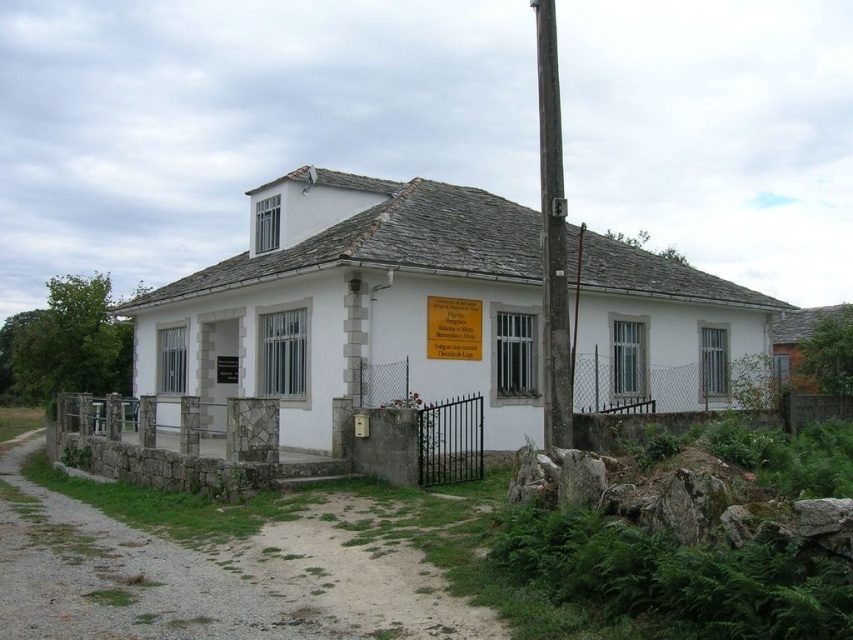
Question: Which object is closer to the camera taking this photo?

Choices:
 (A) smooth wooden pole at right
 (B) wooden plaque at center

Answer: (A)

Question: Which object appears closest to the camera in this image?

Choices:
 (A) wooden plaque at center
 (B) smooth wooden pole at right

Answer: (B)

Question: Does smooth wooden pole at right have a larger size compared to wooden plaque at center?

Choices:
 (A) no
 (B) yes

Answer: (B)

Question: Where is smooth wooden pole at right located in relation to wooden plaque at center in the image?

Choices:
 (A) above
 (B) below

Answer: (A)

Question: Can you confirm if smooth wooden pole at right is wider than wooden plaque at center?

Choices:
 (A) no
 (B) yes

Answer: (B)